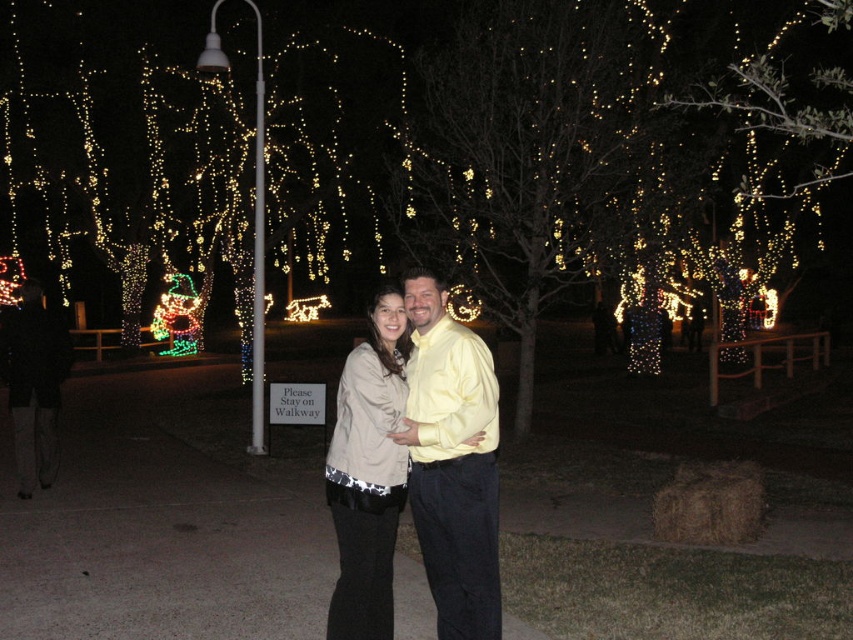
You are trying to decide which jacket to wear for a cold evening walk. Both the matte beige jacket at center and the beige fabric jacket at center are available. Which one offers more warmth based on their size?

The matte beige jacket at center is bigger than the beige fabric jacket at center, so it likely offers more warmth as larger jackets typically provide better insulation.